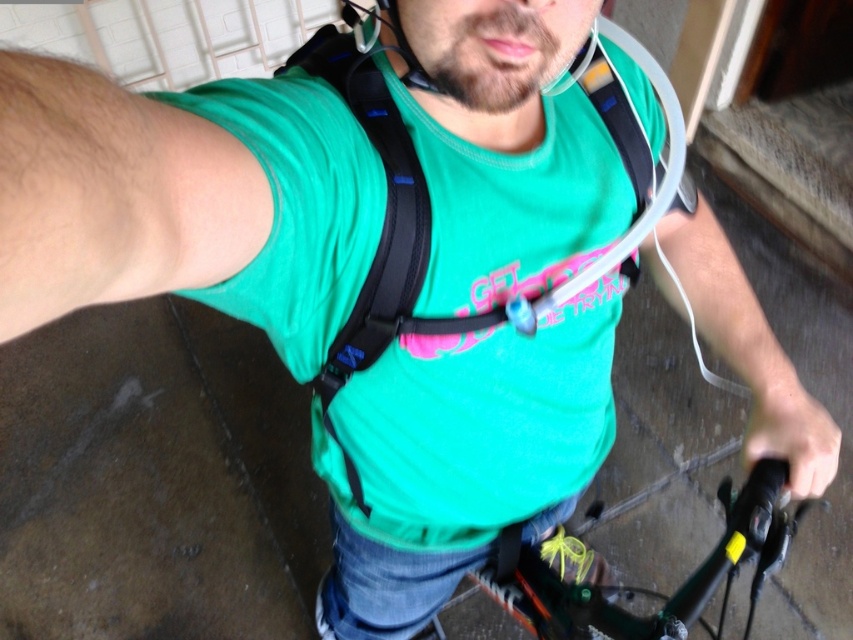
Question: Is black fabric strap at center closer to camera compared to black matte handlebar grip at lower right?

Choices:
 (A) no
 (B) yes

Answer: (B)

Question: Which is nearer to the black fabric strap at center?

Choices:
 (A) green matte bicycle handlebars at lower center
 (B) matte black helmet at upper center

Answer: (B)

Question: Which object is the farthest from the green matte bicycle handlebars at lower center?

Choices:
 (A) black matte handlebar grip at lower right
 (B) matte black helmet at upper center
 (C) black fabric strap at center

Answer: (B)

Question: Does green matte bicycle handlebars at lower center appear under matte black helmet at upper center?

Choices:
 (A) no
 (B) yes

Answer: (B)

Question: Which is nearer to the matte black helmet at upper center?

Choices:
 (A) green matte bicycle handlebars at lower center
 (B) black fabric strap at center

Answer: (B)

Question: Is black fabric strap at center closer to camera compared to matte black helmet at upper center?

Choices:
 (A) no
 (B) yes

Answer: (A)